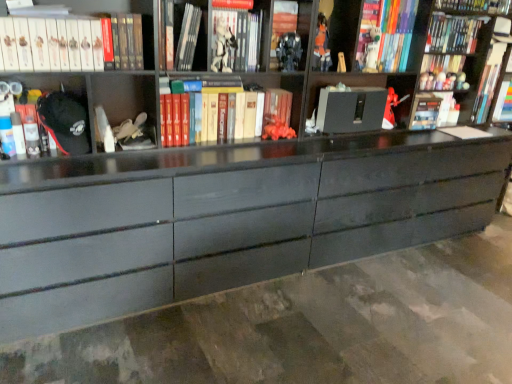
The image size is (512, 384). I want to click on free point above black matte cabinet at center (from a real-world perspective), so click(351, 85).